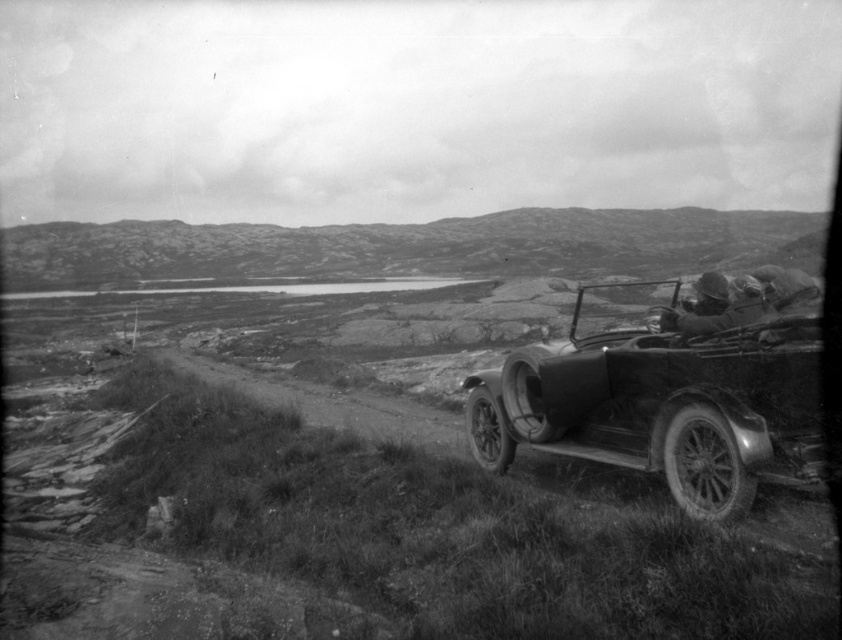
You are a photographer wanting to capture the shiny chrome car at right and the rugged stone hillside at upper center in the same frame. Based on their sizes in the image, which object would appear smaller in the final photo?

The shiny chrome car at right appears smaller in the final photo because it is shorter than the rugged stone hillside at upper center.

Looking at this image, you are standing at the point marked as point (408, 246) in the image. What can you see directly in front of you?

You can see rugged stone hillside at upper center directly in front of you at point (408, 246).

You are standing in the rural landscape scene described. You need to reach the shiny chrome car at right without crossing the dirt road. The road is 4 meters wide. Can you walk around the car safely while staying on the grass?

The shiny chrome car at right is 5.23 meters away from the viewer. Since the road is 4 meters wide, you can walk around the car safely by staying on the grass as long as you maintain a distance of at least 1.23 meters from the car to avoid stepping onto the road.